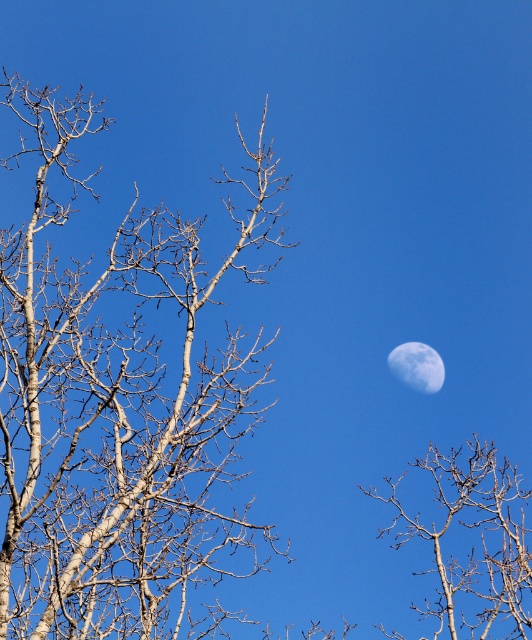
You are an astronomer observing the night sky. You notice the smooth bark tree at right and the smooth white moon at upper right. Which object is positioned higher in the sky?

The smooth white moon at upper right is positioned higher in the sky than the smooth bark tree at right.

Based on the coordinates provided, where is the white smooth birch tree at left located in the image?

The white smooth birch tree at left is located at the coordinates point (x=120, y=406) in the image.

You are an astronomer observing the sky and the trees. Which object would appear larger in the sky from your viewpoint, the white smooth birch tree at left or the smooth white moon at upper right?

The white smooth birch tree at left appears larger than the smooth white moon at upper right from your viewpoint.